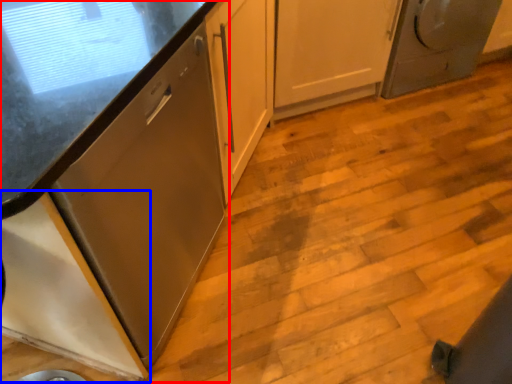
Question: Which object appears farthest to the camera in this image, cabinetry (highlighted by a red box) or cabinetry (highlighted by a blue box)?

Choices:
 (A) cabinetry
 (B) cabinetry

Answer: (A)